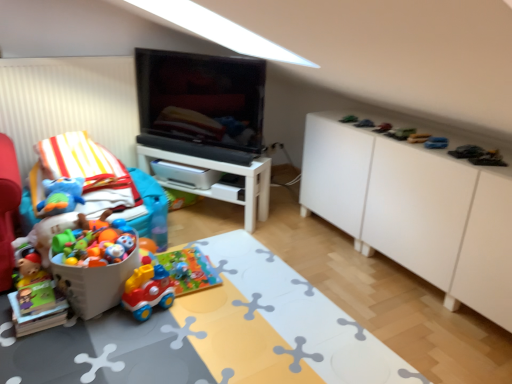
The image size is (512, 384). Find the location of `unoccupied area in front of wooden toy train at lower left, the 2th toy in the left-to-right sequence`. unoccupied area in front of wooden toy train at lower left, the 2th toy in the left-to-right sequence is located at coordinates (31, 346).